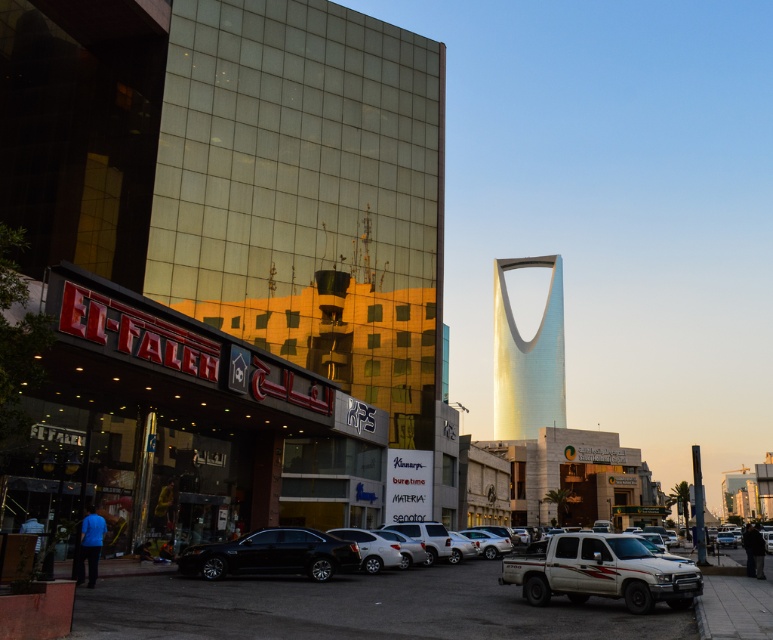
Who is shorter, metallic glass building at center or black glossy sedan at lower center?

With less height is black glossy sedan at lower center.

The width and height of the screenshot is (773, 640). Describe the element at coordinates (225, 264) in the screenshot. I see `metallic glass building at center` at that location.

Which is in front, point (431, 179) or point (325, 563)?

Point (325, 563) is more forward.

The image size is (773, 640). I want to click on metallic glass building at center, so click(225, 264).

Between point (220, 45) and point (557, 552), which one is positioned in front?

Positioned in front is point (557, 552).

Does point (264, 74) lie behind point (620, 561)?

Yes, it is.

Who is more forward, (43, 275) or (584, 557)?

Positioned in front is point (584, 557).

This screenshot has height=640, width=773. What are the coordinates of `metallic glass building at center` in the screenshot? It's located at (225, 264).

Does white matte truck at lower center have a smaller size compared to black glossy sedan at lower center?

Incorrect, white matte truck at lower center is not smaller in size than black glossy sedan at lower center.

Does white matte truck at lower center appear over black glossy sedan at lower center?

Correct, white matte truck at lower center is located above black glossy sedan at lower center.

This screenshot has height=640, width=773. What are the coordinates of `white matte truck at lower center` in the screenshot? It's located at (600, 572).